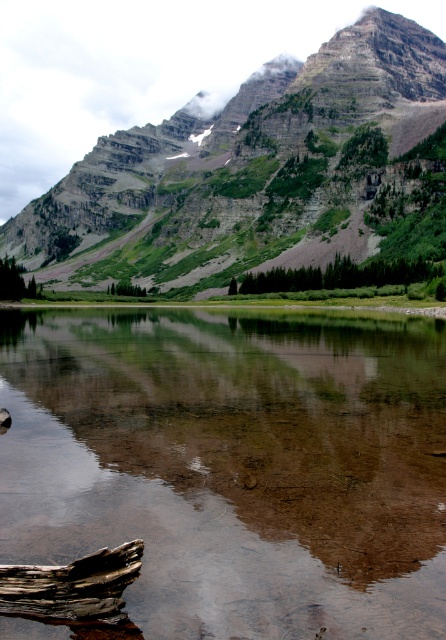
Which is behind, point (318, 484) or point (8, 298)?

Point (8, 298)

Is clear water at center to the right of green leafy tree at lower left from the viewer's perspective?

Correct, you'll find clear water at center to the right of green leafy tree at lower left.

Locate an element on the screen. clear water at center is located at coordinates (234, 465).

You are a GUI agent. You are given a task and a screenshot of the screen. Output one action in this format:
    pyautogui.click(x=<x>, y=<y>)
    Task: Click on the green leafy trees at center
    The height and width of the screenshot is (640, 446).
    Given the screenshot: What is the action you would take?
    pyautogui.click(x=342, y=275)

Who is more forward, (x=244, y=282) or (x=132, y=291)?

Point (x=244, y=282) is in front.

Image resolution: width=446 pixels, height=640 pixels. Identify the location of green leafy trees at center. (342, 275).

Is point (223, 342) more distant than point (392, 275)?

No.

I want to click on clear water at center, so click(x=234, y=465).